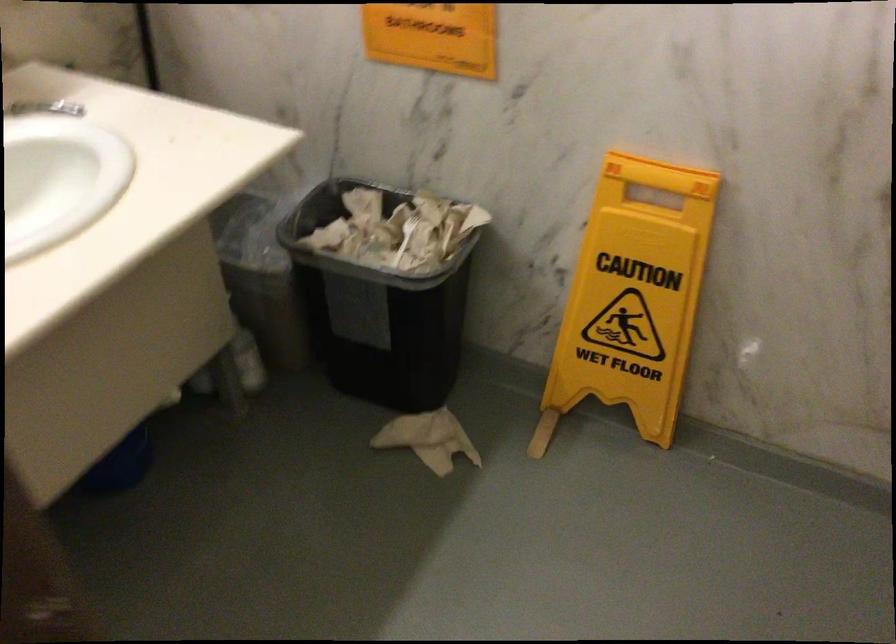
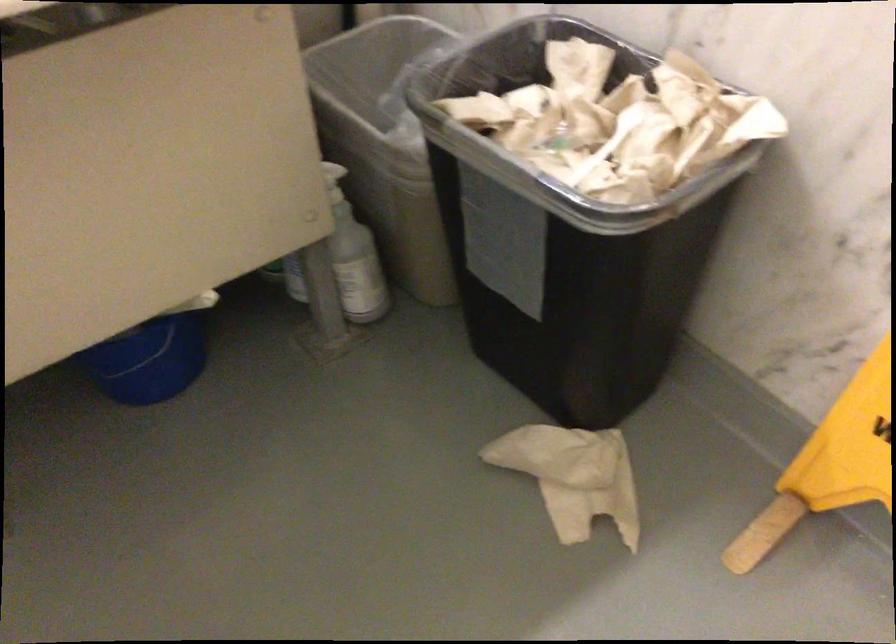
Where in the second image is the point corresponding to point 407,231 from the first image?

(618, 122)